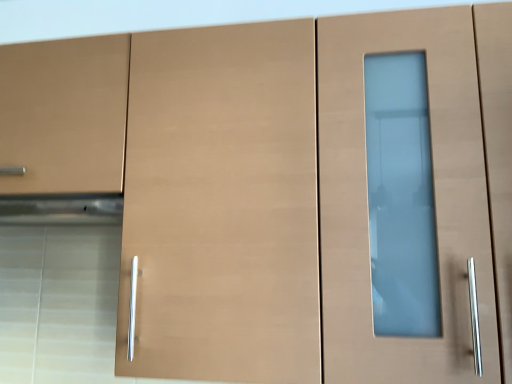
Question: Is matte wood drawer at left in contact with satin silver exhaust hood at left?

Choices:
 (A) yes
 (B) no

Answer: (B)

Question: From the image's perspective, does matte wood drawer at left appear lower than satin silver exhaust hood at left?

Choices:
 (A) no
 (B) yes

Answer: (A)

Question: From a real-world perspective, is matte wood drawer at left on satin silver exhaust hood at left?

Choices:
 (A) yes
 (B) no

Answer: (A)

Question: Is matte wood drawer at left located outside satin silver exhaust hood at left?

Choices:
 (A) no
 (B) yes

Answer: (B)

Question: Considering the relative sizes of matte wood drawer at left and satin silver exhaust hood at left in the image provided, is matte wood drawer at left shorter than satin silver exhaust hood at left?

Choices:
 (A) yes
 (B) no

Answer: (B)

Question: Is satin silver exhaust hood at left a part of matte wood drawer at left?

Choices:
 (A) yes
 (B) no

Answer: (B)

Question: Considering the relative sizes of satin silver exhaust hood at left and matte wood drawer at left in the image provided, is satin silver exhaust hood at left smaller than matte wood drawer at left?

Choices:
 (A) yes
 (B) no

Answer: (A)

Question: Can you confirm if satin silver exhaust hood at left is wider than matte wood drawer at left?

Choices:
 (A) yes
 (B) no

Answer: (B)

Question: Is satin silver exhaust hood at left looking in the opposite direction of matte wood drawer at left?

Choices:
 (A) no
 (B) yes

Answer: (A)

Question: Could you tell me if satin silver exhaust hood at left is facing matte wood drawer at left?

Choices:
 (A) yes
 (B) no

Answer: (B)

Question: Does satin silver exhaust hood at left come behind matte wood drawer at left?

Choices:
 (A) yes
 (B) no

Answer: (A)

Question: Is satin silver exhaust hood at left bigger than matte wood drawer at left?

Choices:
 (A) yes
 (B) no

Answer: (B)

Question: From a real-world perspective, is satin silver exhaust hood at left positioned above or below matte wood drawer at left?

Choices:
 (A) above
 (B) below

Answer: (B)